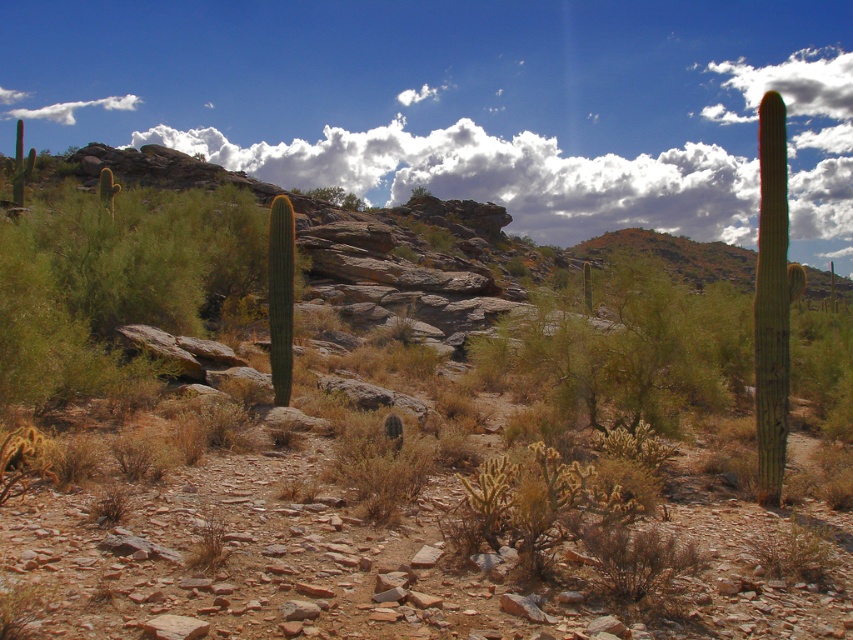
Question: Which point is farther from the camera taking this photo?

Choices:
 (A) (178, 198)
 (B) (708, 112)
 (C) (132, 104)

Answer: (B)

Question: Among these points, which one is farthest from the camera?

Choices:
 (A) (770, 88)
 (B) (73, 100)

Answer: (A)

Question: Is white fluffy cloud at upper center to the left of white fluffy cloud at upper left from the viewer's perspective?

Choices:
 (A) yes
 (B) no

Answer: (B)

Question: Can you confirm if green fuzzy cactus at center-left is positioned to the left of white fluffy cloud at upper left?

Choices:
 (A) yes
 (B) no

Answer: (B)

Question: Which of the following is the farthest from the observer?

Choices:
 (A) (811, 60)
 (B) (173, 289)
 (C) (62, 115)

Answer: (A)

Question: From the image, what is the correct spatial relationship of green fuzzy cactus at center-left in relation to white fluffy cloud at upper left?

Choices:
 (A) right
 (B) left

Answer: (A)